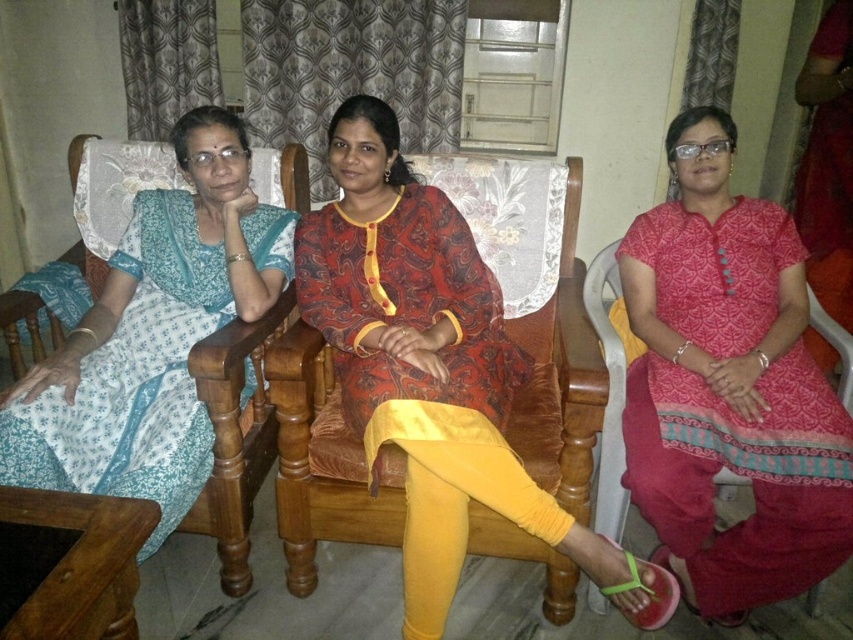
You are a photographer setting up a shoot in a living room with traditional decor. You need to position two models wearing the matte red dress at center and the light blue printed dress at left. According to the scene, which dress is positioned to the right of the other?

The matte red dress at center is positioned to the right of the light blue printed dress at left.

You are a photographer setting up a shoot in the living room. You need to position a camera on a tripod so that both the matte pink dress at center and the light blue printed dress at left are in the frame. Based on their positions, which dress is lower in the image?

The matte pink dress at center is below the light blue printed dress at left, so it will appear lower in the image.

You are standing in the living room and want to reach a point that is exactly 1.84 meters away from you. Can you confirm if the point at coordinates point (718, 275) is exactly that distance away?

The distance of point (718, 275) from viewer is 1.84 meters, so yes, the point at coordinates point (718, 275) is exactly 1.84 meters away from you.